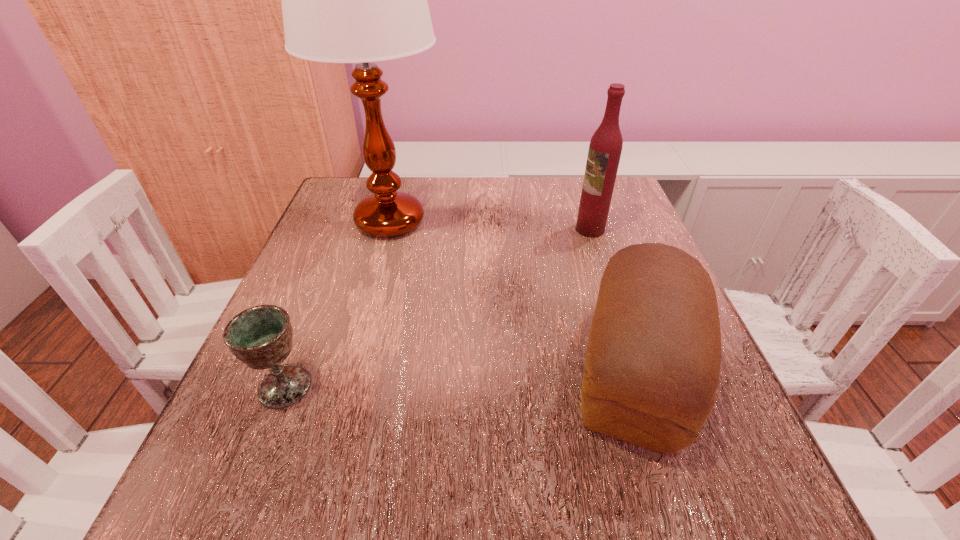
Where is `blank region between the third tallest object and the shortest object`? blank region between the third tallest object and the shortest object is located at coordinates (459, 379).

I want to click on free spot between the second shortest object and the tallest object, so click(x=512, y=296).

At what (x,y) coordinates should I click in order to perform the action: click on free point between the tallest object and the shortest object. Please return your answer as a coordinate pair (x, y). This screenshot has width=960, height=540. Looking at the image, I should click on (x=337, y=304).

At what (x,y) coordinates should I click in order to perform the action: click on unoccupied area between the shortest object and the second tallest object. Please return your answer as a coordinate pair (x, y). Looking at the image, I should click on (438, 308).

Select which object is the second closest to the chalice. Please provide its 2D coordinates. Your answer should be formatted as a tuple, i.e. [(x, y)], where the tuple contains the x and y coordinates of a point satisfying the conditions above.

[(653, 359)]

You are a GUI agent. You are given a task and a screenshot of the screen. Output one action in this format:
    pyautogui.click(x=<x>, y=<y>)
    Task: Click on the object that is the second closest to the second tallest object
    
    Given the screenshot: What is the action you would take?
    pyautogui.click(x=360, y=0)

Locate an element on the screen. The height and width of the screenshot is (540, 960). blank space that satisfies the following two spatial constraints: 1. on the label of the second tallest object; 2. on the front side of the shortest object is located at coordinates (641, 387).

Locate an element on the screen. The height and width of the screenshot is (540, 960). free point that satisfies the following two spatial constraints: 1. on the back side of the chalice; 2. on the right side of the second shortest object is located at coordinates (291, 372).